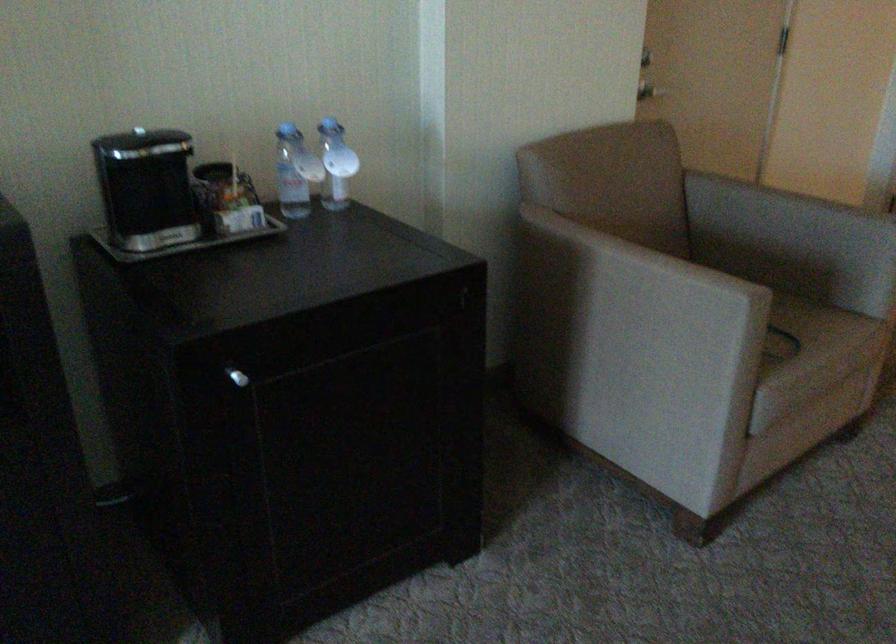
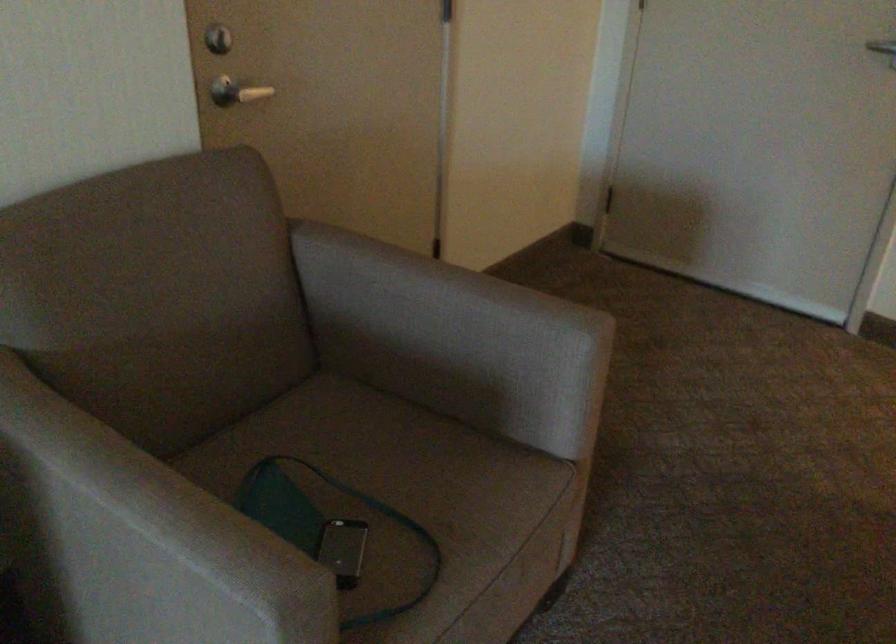
The point at (657, 75) is marked in the first image. Where is the corresponding point in the second image?

(236, 91)